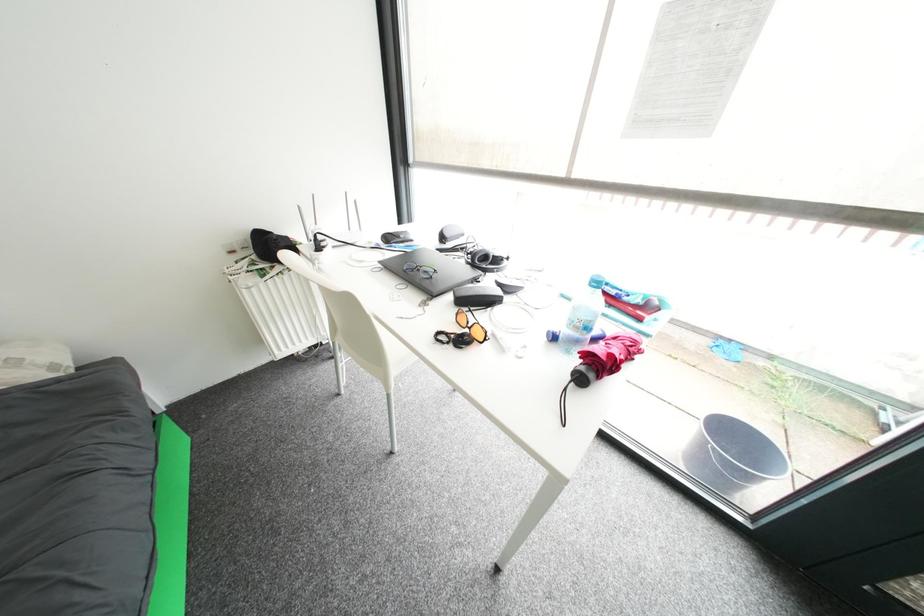
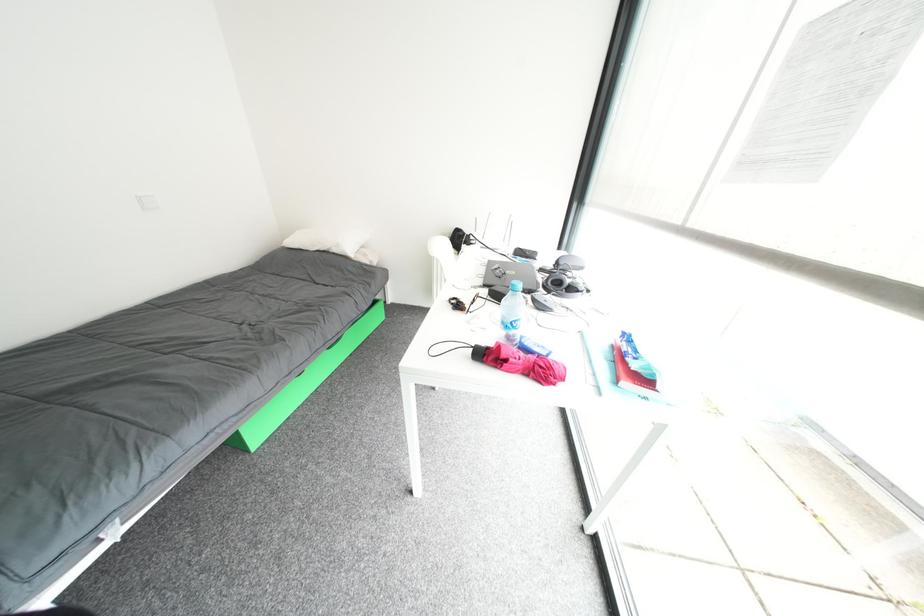
Question: The images are taken continuously from a first-person perspective. In which direction is your viewpoint rotating?

Choices:
 (A) Left
 (B) Right
 (C) Up
 (D) Down

Answer: (A)